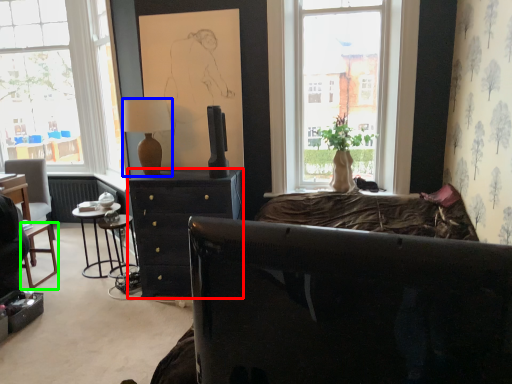
Question: Which is farther away from desk (highlighted by a red box)? lamp (highlighted by a blue box) or bar stool (highlighted by a green box)?

Choices:
 (A) lamp
 (B) bar stool

Answer: (B)